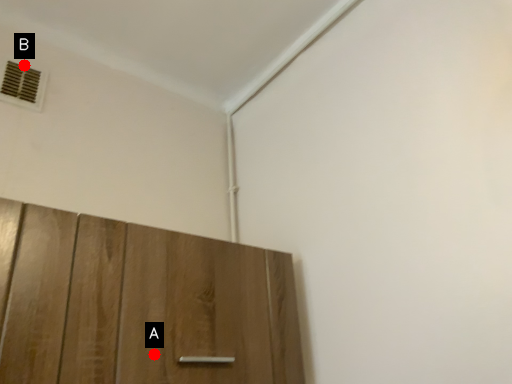
Question: Two points are circled on the image, labeled by A and B beside each circle. Which point appears farthest from the camera in this image?

Choices:
 (A) A is further
 (B) B is further

Answer: (B)